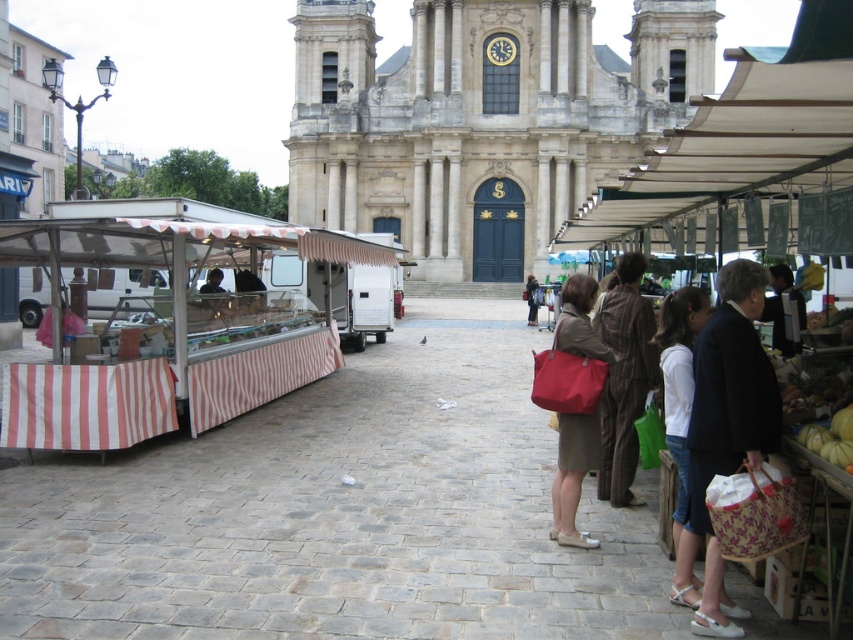
You are standing at the market stalls and want to show someone the stone church at center and the white fabric bag at center. Which one is positioned to the left?

The stone church at center is to the left of the white fabric bag at center.

You are a tourist holding a white fabric bag at center and want to take a photo of the stone church at center. Can you stand where you are and take the photo without moving closer? Explain why or why not.

The distance between the stone church at center and the white fabric bag at center is 211.61 feet, which is quite far. However, modern cameras and smartphones can capture clear images from such distances, especially of large structures like churches. Therefore, you can likely take the photo without moving closer, provided there are no obstructions between you and the church.

You are standing in the market and want to locate the white striped fabric at left. According to the coordinates provided, where should you look relative to the historic building?

The white striped fabric at left is located at coordinates point [172,323], which means it is positioned approximately halfway along the horizontal axis and one fifth up the vertical axis from the bottom of the image, relative to the historic building.